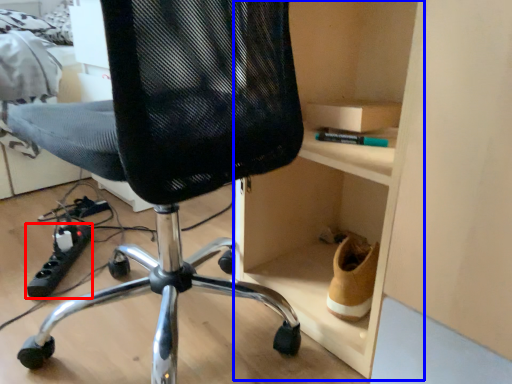
Question: Which of the following is the closest to the observer, equipment (highlighted by a red box) or cabinet (highlighted by a blue box)?

Choices:
 (A) equipment
 (B) cabinet

Answer: (B)